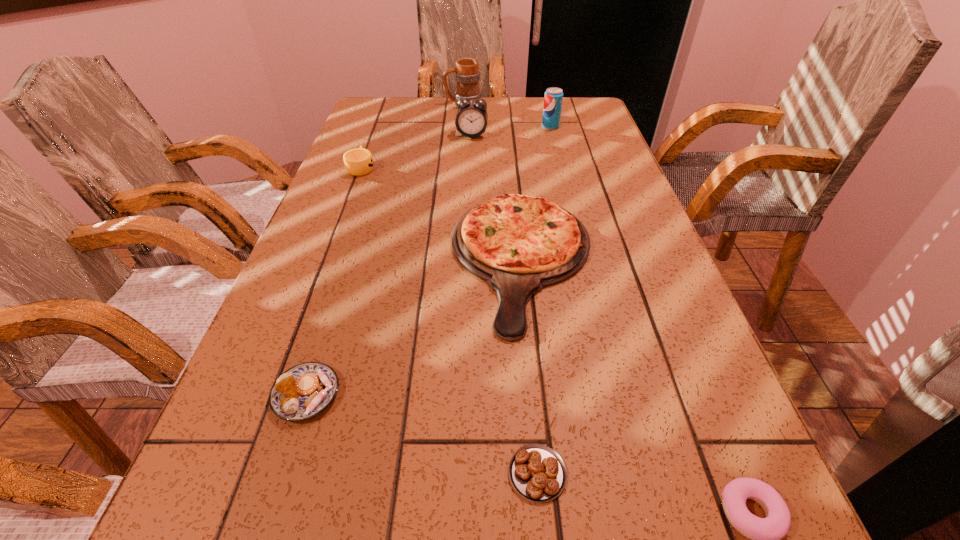
Where is `soda can positioned at the far edge`? soda can positioned at the far edge is located at coordinates (553, 98).

Find the location of `cup positioned at the left edge`. cup positioned at the left edge is located at coordinates (358, 162).

In order to click on pastry located at the left edge in this screenshot , I will do `click(305, 390)`.

Image resolution: width=960 pixels, height=540 pixels. I want to click on soda can located at the right edge, so click(x=553, y=98).

Identify the location of pizza at the right edge. (518, 244).

Image resolution: width=960 pixels, height=540 pixels. I want to click on object that is at the far right corner, so click(553, 98).

Where is `blank area at the far edge`? blank area at the far edge is located at coordinates (543, 102).

The width and height of the screenshot is (960, 540). In order to click on vacant space at the left edge in this screenshot , I will do `click(193, 489)`.

In the image, there is a desktop. Find the location of `vacant space at the right edge`. vacant space at the right edge is located at coordinates [x=601, y=130].

This screenshot has width=960, height=540. What are the coordinates of `free space at the far left corner` in the screenshot? It's located at (371, 97).